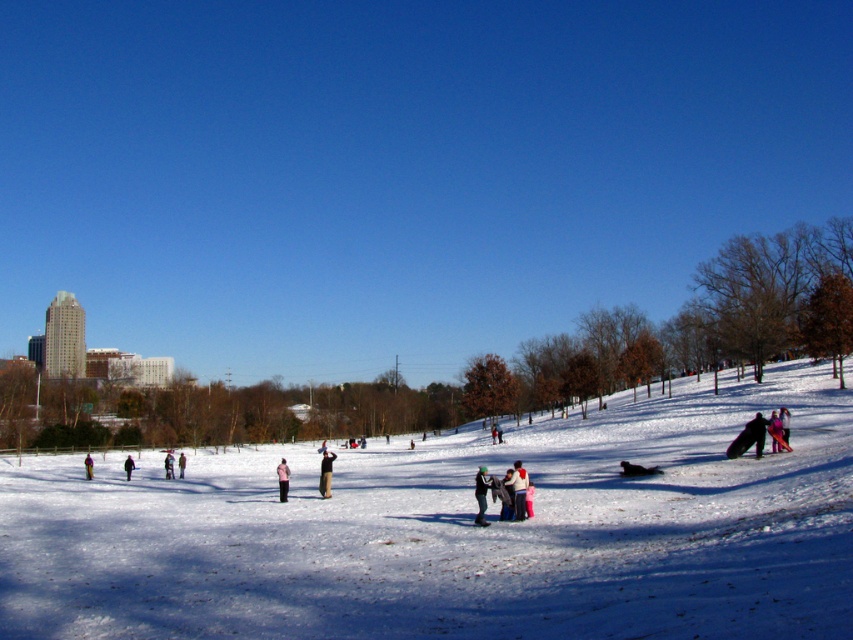
You are standing in the winter park scene and want to walk towards the two points marked in the image. Which point, point (519, 477) or point (773, 410), will you reach first?

You will reach point (519, 477) first because it is closer to you than point (773, 410).

You are standing at the center of the snowy field and want to find the dark gray pants at lower left. According to the image coordinates, which direction should you move to reach them?

The dark gray pants at lower left are located at coordinates point [128,467], so you should move to the lower left direction to reach them.